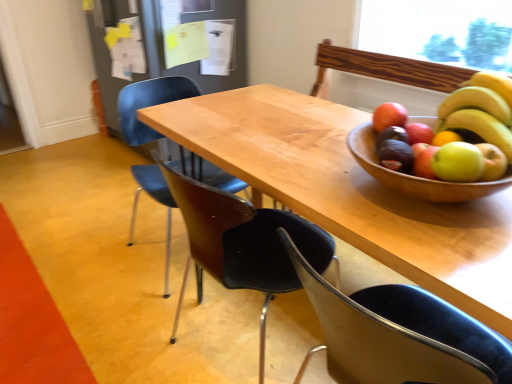
Question: Should I look upward or downward to see matte black chair at center, arranged as the 1th chair when viewed from the back?

Choices:
 (A) down
 (B) up

Answer: (B)

Question: Should I look upward or downward to see green matte avocado at right, the 2th avocado in the front-to-back sequence?

Choices:
 (A) down
 (B) up

Answer: (B)

Question: Does green matte avocado at right, the 2th avocado in the front-to-back sequence, have a lesser height compared to matte black avocado at right, which appears as the 2th avocado when viewed from the back?

Choices:
 (A) no
 (B) yes

Answer: (B)

Question: From a real-world perspective, is green matte avocado at right, the 2th avocado in the front-to-back sequence, positioned under matte black avocado at right, which appears as the 2th avocado when viewed from the back, based on gravity?

Choices:
 (A) no
 (B) yes

Answer: (B)

Question: Is green matte avocado at right, the 1th avocado when ordered from back to front, positioned beyond the bounds of matte black avocado at right, which is the first avocado from front to back?

Choices:
 (A) no
 (B) yes

Answer: (B)

Question: From a real-world perspective, is green matte avocado at right, the 2th avocado in the front-to-back sequence, physically above matte black avocado at right, which is the first avocado from front to back?

Choices:
 (A) no
 (B) yes

Answer: (A)

Question: Would you say green matte avocado at right, the 2th avocado in the front-to-back sequence, is a long distance from matte black avocado at right, which appears as the 2th avocado when viewed from the back?

Choices:
 (A) yes
 (B) no

Answer: (B)

Question: Considering the relative sizes of green matte avocado at right, the 2th avocado in the front-to-back sequence, and matte black avocado at right, which is the first avocado from front to back, in the image provided, is green matte avocado at right, the 2th avocado in the front-to-back sequence, wider than matte black avocado at right, which is the first avocado from front to back,?

Choices:
 (A) no
 (B) yes

Answer: (A)

Question: Is matte black avocado at right, which appears as the 2th avocado when viewed from the back, at the back of black plastic chair at lower right, which is the third chair in back-to-front order?

Choices:
 (A) no
 (B) yes

Answer: (A)

Question: Is black plastic chair at lower right, placed as the first chair when sorted from front to back, facing towards matte black avocado at right, which appears as the 2th avocado when viewed from the back?

Choices:
 (A) no
 (B) yes

Answer: (A)

Question: Would you say black plastic chair at lower right, which is the third chair in back-to-front order, is outside matte black avocado at right, which is the first avocado from front to back?

Choices:
 (A) no
 (B) yes

Answer: (B)

Question: Does black plastic chair at lower right, which is the third chair in back-to-front order, have a greater height compared to matte black avocado at right, which appears as the 2th avocado when viewed from the back?

Choices:
 (A) yes
 (B) no

Answer: (A)

Question: Can you confirm if black plastic chair at lower right, placed as the first chair when sorted from front to back, is thinner than matte black avocado at right, which appears as the 2th avocado when viewed from the back?

Choices:
 (A) yes
 (B) no

Answer: (B)

Question: Is the depth of black plastic chair at lower right, which is the third chair in back-to-front order, greater than that of matte black avocado at right, which appears as the 2th avocado when viewed from the back?

Choices:
 (A) no
 (B) yes

Answer: (A)

Question: From a real-world perspective, is yellow matte bananas at upper right positioned over matte black chair at center, positioned as the third chair in front-to-back order, based on gravity?

Choices:
 (A) yes
 (B) no

Answer: (A)